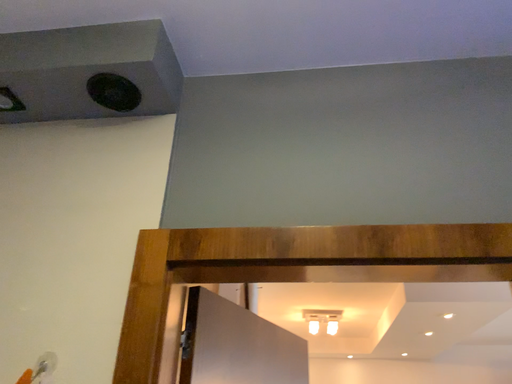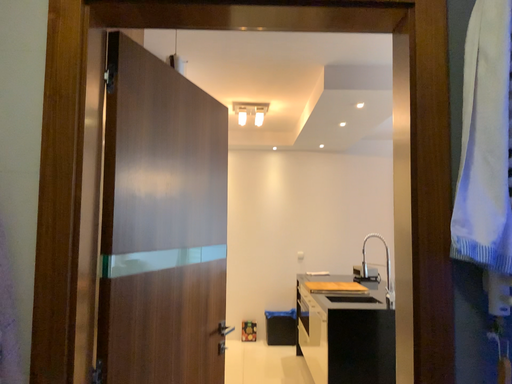
Question: How did the camera likely rotate when shooting the video?

Choices:
 (A) rotated downward
 (B) rotated upward

Answer: (A)